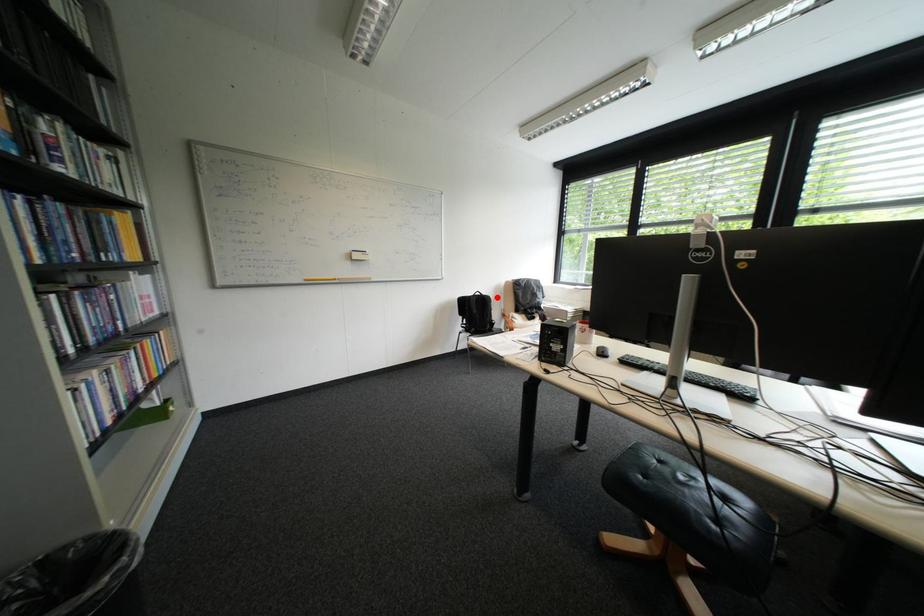
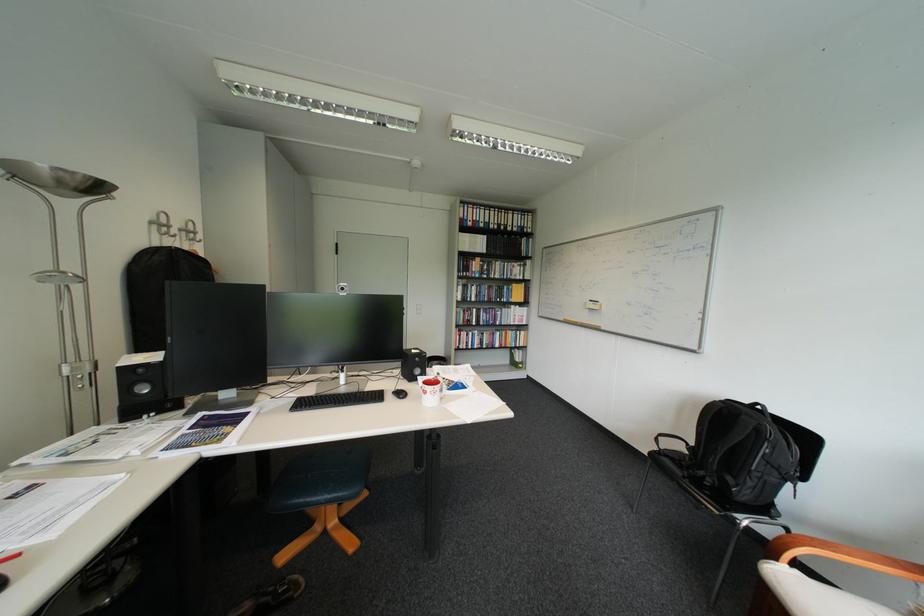
Locate, in the second image, the point that corresponds to the highlighted location in the first image.

(756, 418)